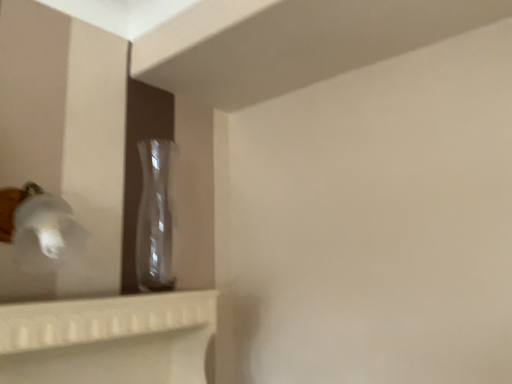
Describe the element at coordinates (155, 218) in the screenshot. Image resolution: width=512 pixels, height=384 pixels. I see `transparent glass vase at center` at that location.

Locate an element on the screen. transparent glass vase at center is located at coordinates (x=155, y=218).

What is the approximate width of transparent glass vase at center?

The width of transparent glass vase at center is 4.96 inches.

Identify the location of transparent glass vase at center. The height and width of the screenshot is (384, 512). (155, 218).